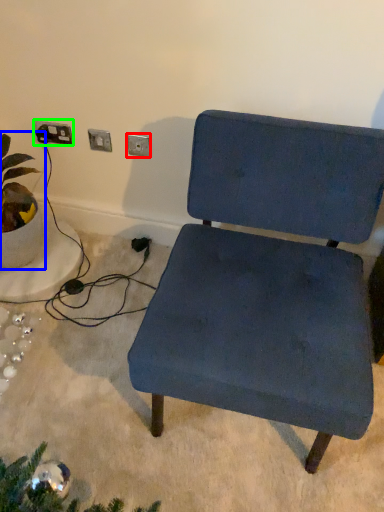
Question: Which is farther away from electric outlet (highlighted by a red box)? houseplant (highlighted by a blue box) or electric outlet (highlighted by a green box)?

Choices:
 (A) houseplant
 (B) electric outlet

Answer: (A)